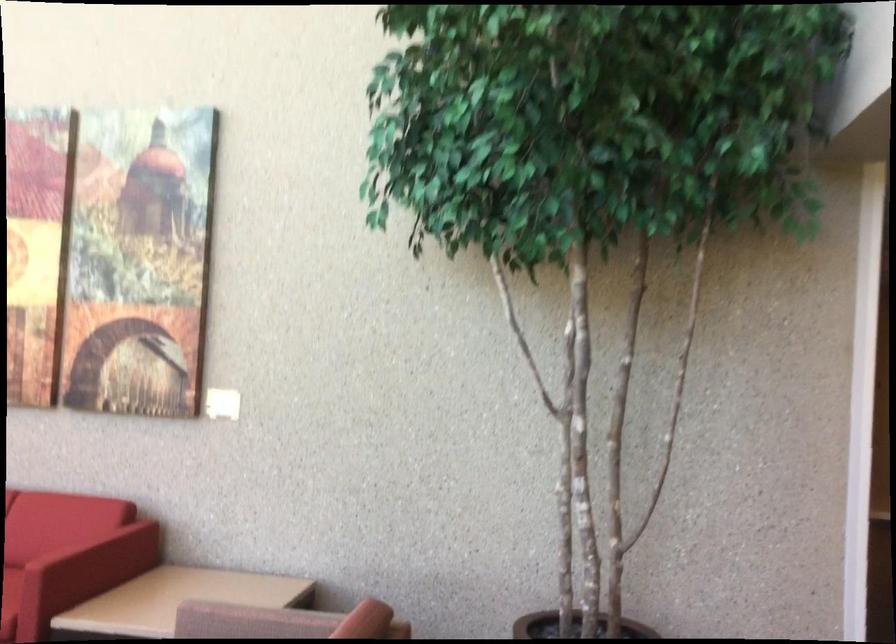
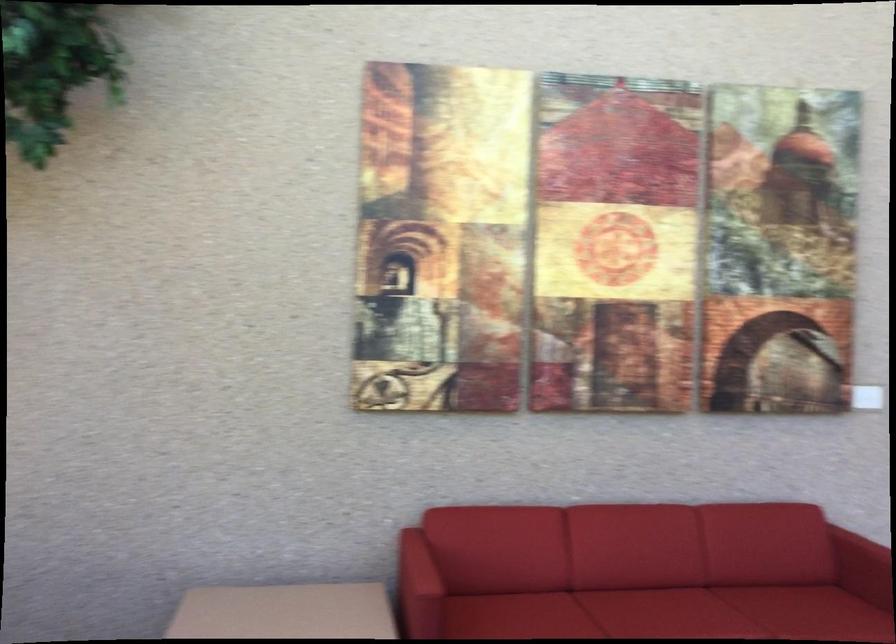
Locate, in the second image, the point that corresponds to [85,547] in the first image.

(864, 558)